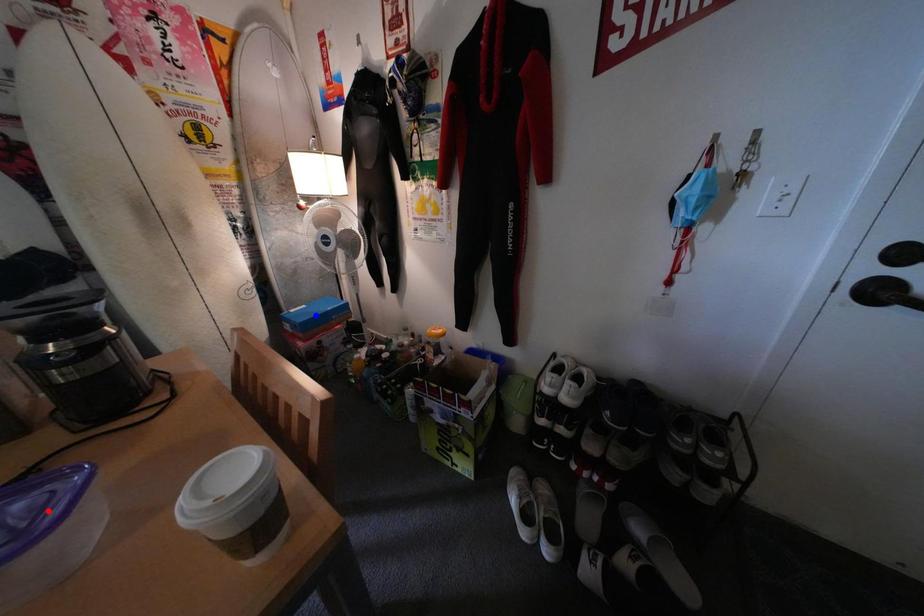
Question: Two points are marked on the image. Which point is closer to the camera?

Choices:
 (A) Blue point is closer.
 (B) Red point is closer.

Answer: (B)